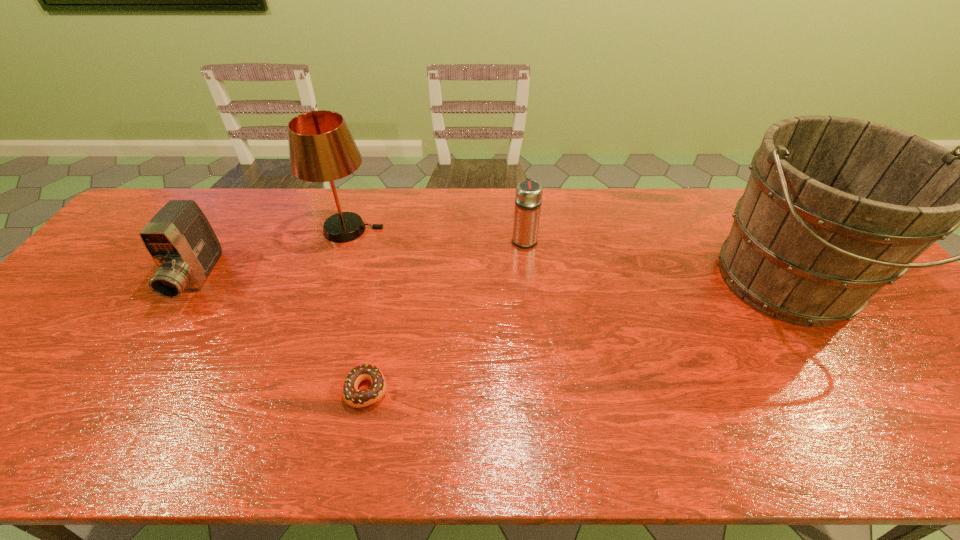
You are a GUI agent. You are given a task and a screenshot of the screen. Output one action in this format:
    pyautogui.click(x=<x>, y=<y>)
    Task: Click on the blank area located with a handle on the side of the second object from right to left
    
    Given the screenshot: What is the action you would take?
    pyautogui.click(x=520, y=201)

Where is `vacant space located 0.180m with a handle on the side of the second object from right to left`? vacant space located 0.180m with a handle on the side of the second object from right to left is located at coordinates (519, 195).

The image size is (960, 540). I want to click on free location located 0.190m on the left of the nearest object, so click(x=261, y=390).

Locate an element on the screen. bucket at the far edge is located at coordinates (835, 208).

Where is `lampshade present at the far edge`? The width and height of the screenshot is (960, 540). lampshade present at the far edge is located at coordinates tap(321, 148).

The height and width of the screenshot is (540, 960). In order to click on thermos bottle positioned at the far edge in this screenshot , I will do `click(528, 198)`.

Where is `object that is at the right edge`? object that is at the right edge is located at coordinates tap(835, 208).

Locate an element on the screen. object at the far right corner is located at coordinates pyautogui.click(x=835, y=208).

Where is `vacant area at the far edge of the desktop`? The height and width of the screenshot is (540, 960). vacant area at the far edge of the desktop is located at coordinates (331, 191).

In the image, there is a desktop. Identify the location of free space at the near edge. (333, 448).